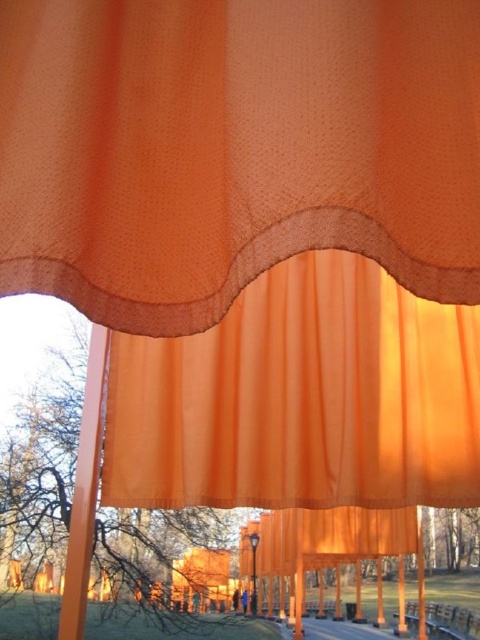
Question: Is translucent orange curtain at upper center behind orange sheer curtain at center?

Choices:
 (A) yes
 (B) no

Answer: (B)

Question: Which point is closer to the camera?

Choices:
 (A) (440, 449)
 (B) (62, 8)

Answer: (B)

Question: Which point is farther from the camera taking this photo?

Choices:
 (A) (416, 378)
 (B) (374, 22)

Answer: (A)

Question: Does translucent orange curtain at upper center have a larger size compared to orange sheer curtain at center?

Choices:
 (A) yes
 (B) no

Answer: (B)

Question: Is the position of translucent orange curtain at upper center less distant than that of orange sheer curtain at center?

Choices:
 (A) yes
 (B) no

Answer: (A)